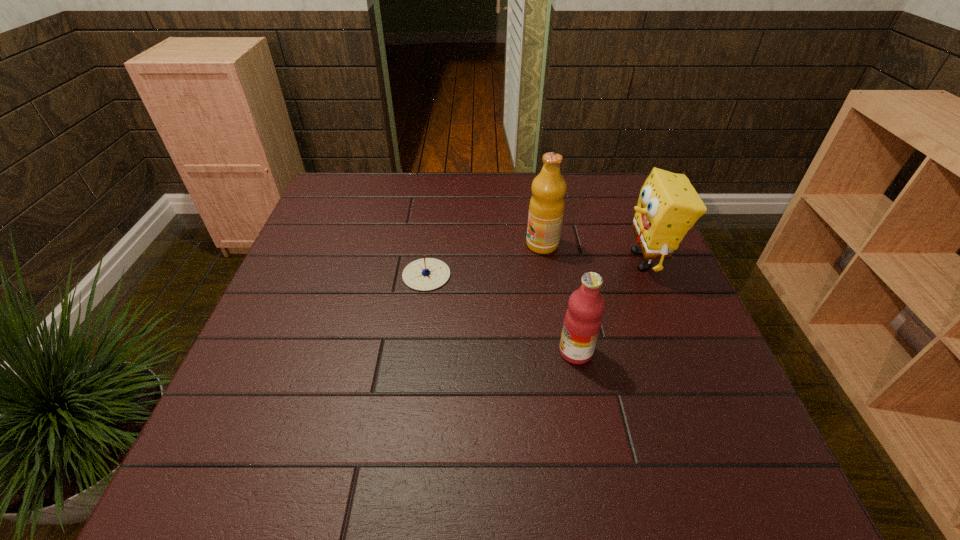
The height and width of the screenshot is (540, 960). Find the location of `free location at the right edge of the desktop`. free location at the right edge of the desktop is located at coordinates (655, 332).

This screenshot has height=540, width=960. I want to click on vacant space at the near left corner of the desktop, so click(x=288, y=465).

Image resolution: width=960 pixels, height=540 pixels. What are the coordinates of `empty location between the taller fruit juice and the shortest object` in the screenshot? It's located at (484, 260).

This screenshot has width=960, height=540. Find the location of `vacant area between the rightmost object and the taller fruit juice`. vacant area between the rightmost object and the taller fruit juice is located at coordinates (593, 253).

I want to click on free point between the sponge and the farther fruit juice, so click(x=593, y=253).

Find the location of a particular element. This screenshot has height=540, width=960. empty space that is in between the nearer fruit juice and the rightmost object is located at coordinates (611, 306).

You are a GUI agent. You are given a task and a screenshot of the screen. Output one action in this format:
    pyautogui.click(x=<x>, y=<y>)
    Task: Click on the free space between the farther fruit juice and the compass
    
    Given the screenshot: What is the action you would take?
    pyautogui.click(x=484, y=260)

You are a GUI agent. You are given a task and a screenshot of the screen. Output one action in this format:
    pyautogui.click(x=<x>, y=<y>)
    Task: Click on the free space between the farther fruit juice and the sponge
    This screenshot has width=960, height=540.
    Given the screenshot: What is the action you would take?
    pyautogui.click(x=593, y=253)

The image size is (960, 540). I want to click on empty space that is in between the farther fruit juice and the sponge, so click(593, 253).

Identify the location of blank region between the shorter fruit juice and the taller fruit juice. The height and width of the screenshot is (540, 960). (559, 298).